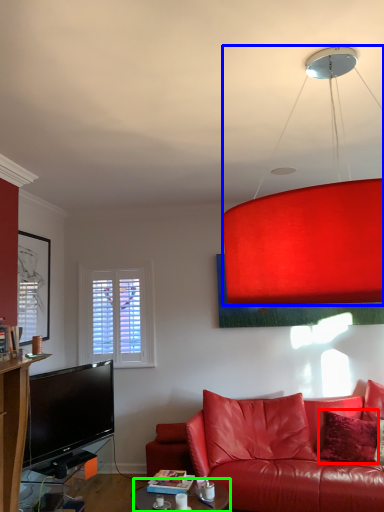
Question: Considering the real-world distances, which object is farthest from pillow (highlighted by a red box)? lamp (highlighted by a blue box) or table (highlighted by a green box)?

Choices:
 (A) lamp
 (B) table

Answer: (A)